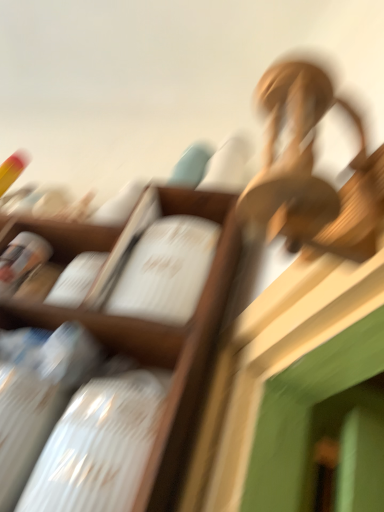
The image size is (384, 512). What do you see at coordinates (164, 341) in the screenshot?
I see `wooden shelf at center` at bounding box center [164, 341].

You are a GUI agent. You are given a task and a screenshot of the screen. Output one action in this format:
    pyautogui.click(x=<x>, y=<y>)
    Task: Click on the wooden shelf at center
    This screenshot has height=512, width=384.
    Given the screenshot: What is the action you would take?
    pyautogui.click(x=164, y=341)

I want to click on wooden shelf at center, so click(x=164, y=341).